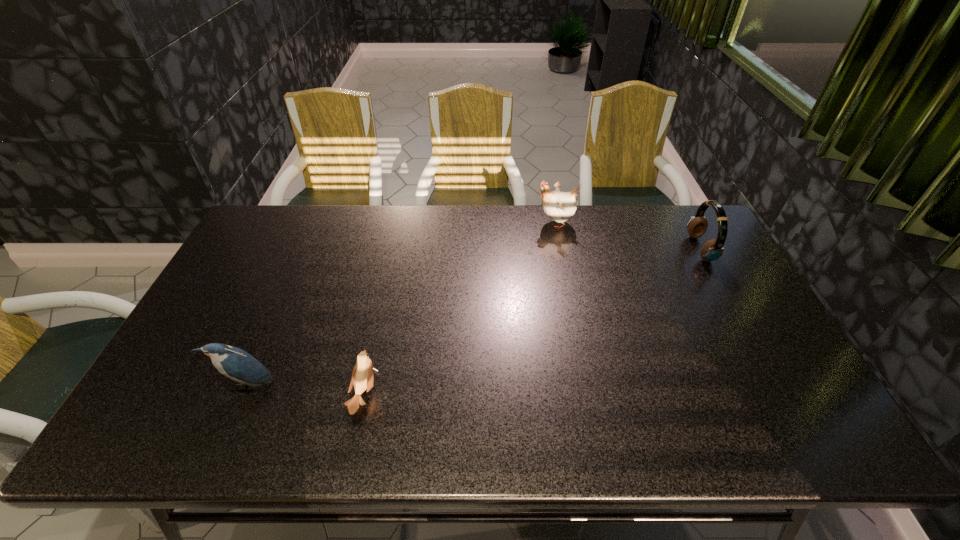
At what (x,y) coordinates should I click in order to perform the action: click on vacant area situated on the ear cup of the rightmost object. Please return your answer as a coordinate pair (x, y). The image size is (960, 540). Looking at the image, I should click on (660, 249).

I want to click on vacant space located 0.160m on the ear cup of the rightmost object, so click(642, 249).

Find the location of a particular element. The height and width of the screenshot is (540, 960). vacant space located 0.050m at the tip of the leftmost bird's beak is located at coordinates (233, 415).

I want to click on vacant region located at the beak of the second bird from left to right, so coord(463,394).

I want to click on bird that is at the far edge, so click(559, 206).

The height and width of the screenshot is (540, 960). I want to click on headset that is at the far edge, so click(712, 250).

Where is `object located in the near edge section of the desktop`? This screenshot has height=540, width=960. object located in the near edge section of the desktop is located at coordinates (362, 377).

Where is `object that is positioned at the left edge`? The width and height of the screenshot is (960, 540). object that is positioned at the left edge is located at coordinates (238, 365).

Locate an element on the screen. The width and height of the screenshot is (960, 540). object present at the right edge is located at coordinates (712, 250).

The width and height of the screenshot is (960, 540). Find the location of `object present at the far right corner`. object present at the far right corner is located at coordinates (712, 250).